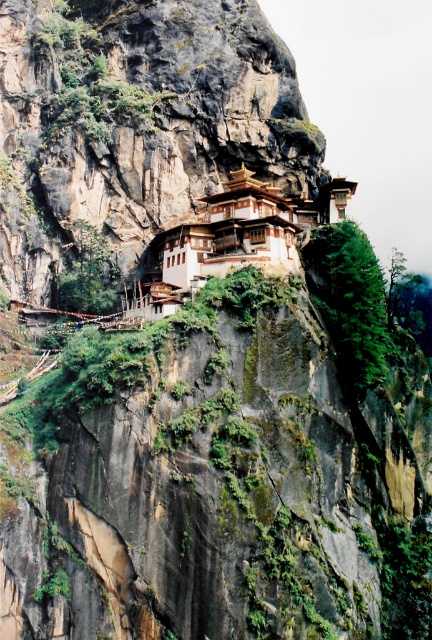
You are standing at the base of the cliff looking up at the temple. There are two points marked on the cliff face. The first point is at coordinates point (x=34, y=188) and the second is at point (x=178, y=307). Which point is closer to the edge of the cliff?

Point (x=178, y=307) is closer to the edge of the cliff because it is in front of point (x=34, y=188) according to their spatial positioning.

You are an architect evaluating the stability of the structures on the cliff. Given that the brown wooden structure at center is taller than the brown wooden monastery at center, which one might pose a higher risk of toppling over due to its height?

The brown wooden structure at center has a greater height compared to the brown wooden monastery at center, so it might pose a higher risk of toppling over due to its height.